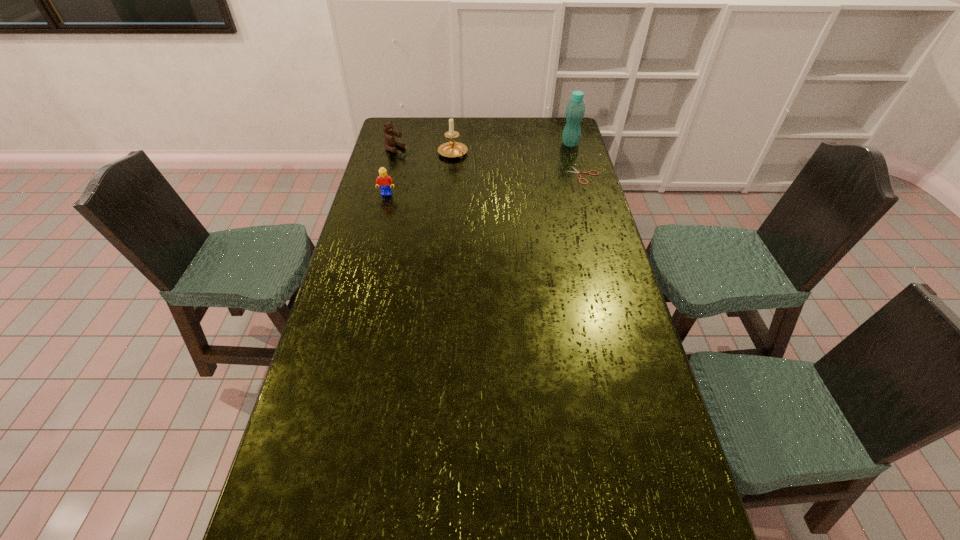
The width and height of the screenshot is (960, 540). Find the location of `vacant point that satisfies the following two spatial constraints: 1. on the front side of the teddy bear; 2. on the left side of the third object from left to right`. vacant point that satisfies the following two spatial constraints: 1. on the front side of the teddy bear; 2. on the left side of the third object from left to right is located at coordinates (394, 153).